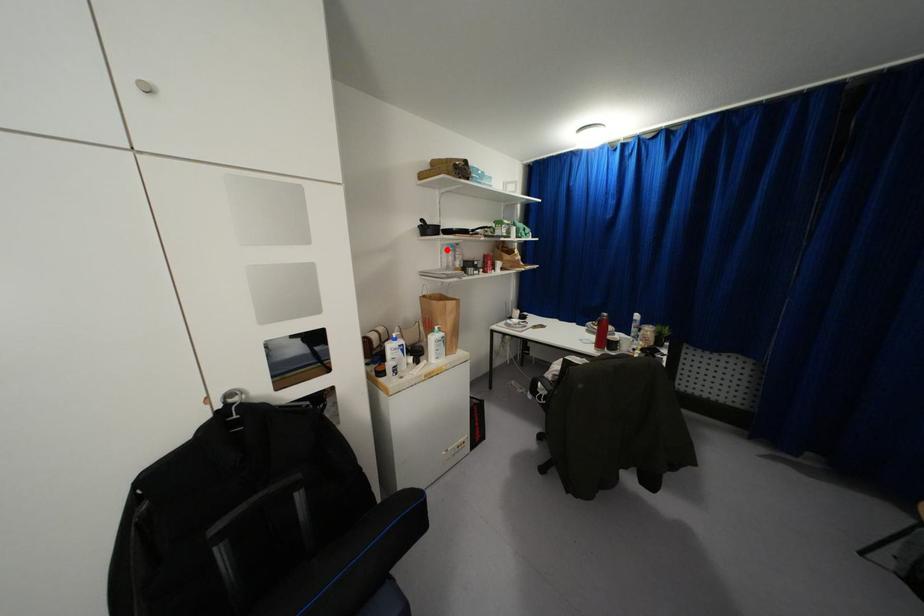
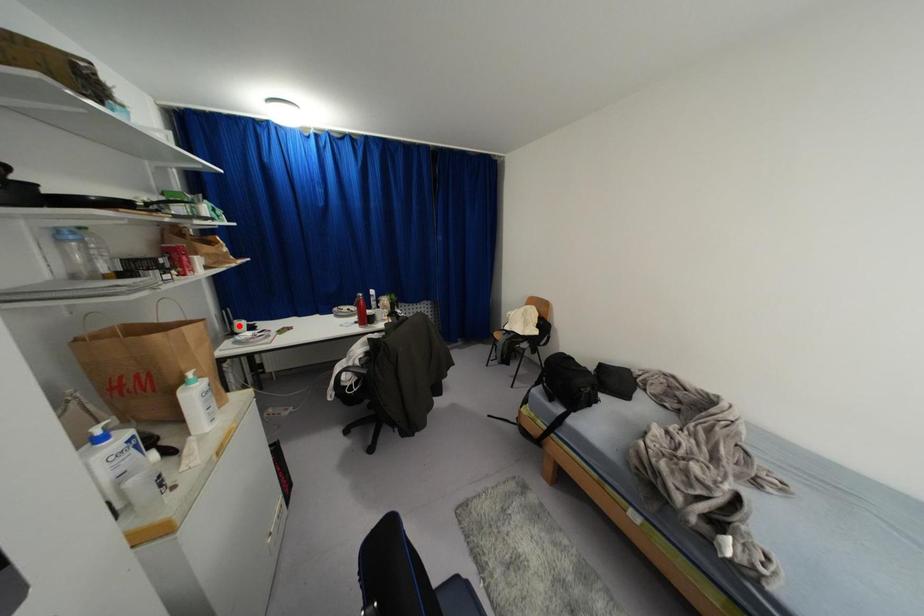
I am providing you with two images of the same scene from different viewpoints. A red point is marked on the first image and another point is marked on the second image. Do the highlighted points in image1 and image2 indicate the same real-world spot?

No